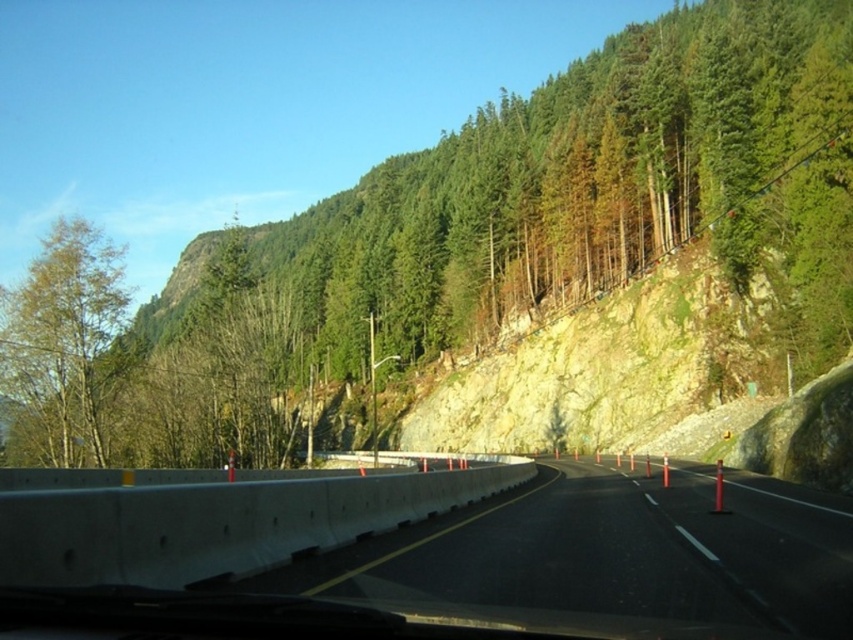
Question: Which point is closer to the camera taking this photo?

Choices:
 (A) (809, 577)
 (B) (67, 442)

Answer: (A)

Question: Does green textured tree at upper center lie in front of concrete barrier at center?

Choices:
 (A) yes
 (B) no

Answer: (B)

Question: Which object is closer to the camera taking this photo?

Choices:
 (A) green matte tree at left
 (B) green textured tree at upper center

Answer: (A)

Question: Does green textured tree at upper center have a smaller size compared to concrete barrier at center?

Choices:
 (A) yes
 (B) no

Answer: (B)

Question: Considering the real-world distances, which object is farthest from the concrete barrier at center?

Choices:
 (A) green matte tree at left
 (B) green textured tree at upper center

Answer: (B)

Question: Is green textured tree at upper center thinner than green matte tree at left?

Choices:
 (A) no
 (B) yes

Answer: (A)